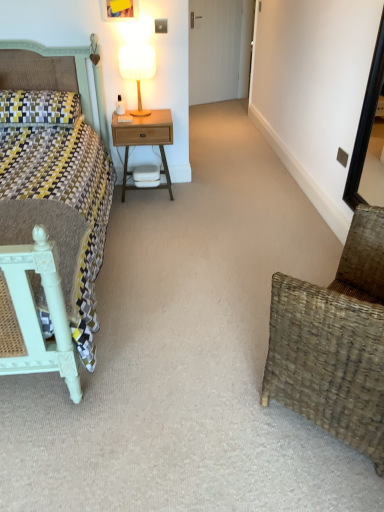
Locate an element on the screen. The height and width of the screenshot is (512, 384). free location in front of woodenmaterial/texturenightstand at center is located at coordinates (150, 210).